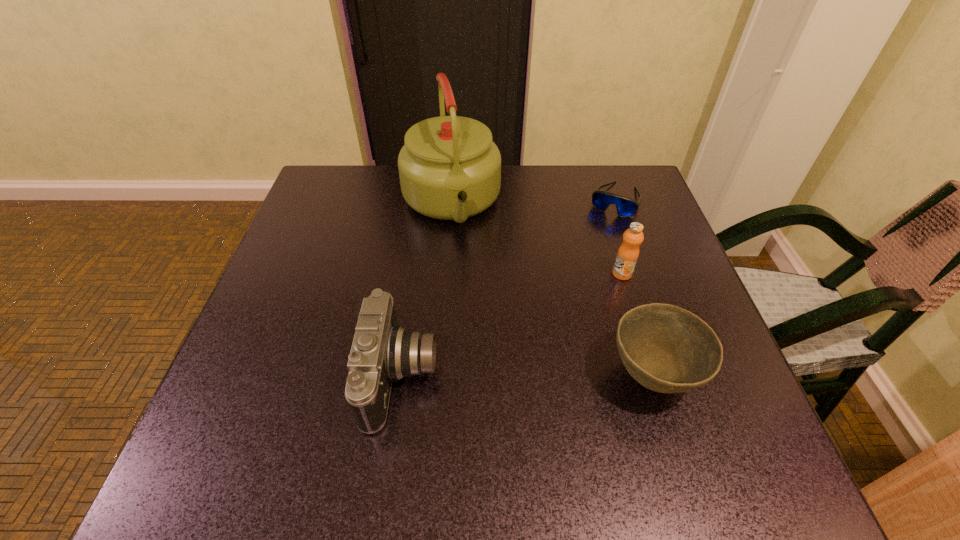
At what (x,y) coordinates should I click in order to perform the action: click on vacant space on the desktop that is between the camera and the bowl and is positioned on the front-facing side of the shortest object. Please return your answer as a coordinate pair (x, y). The height and width of the screenshot is (540, 960). Looking at the image, I should click on (529, 375).

Image resolution: width=960 pixels, height=540 pixels. What are the coordinates of `vacant space on the desktop that is between the camera and the second shortest object and is positioned on the front label of the third nearest object` in the screenshot? It's located at (519, 375).

Where is `free space on the desktop that is between the camera and the second shortest object and is positioned at the spout of the tallest object`? This screenshot has width=960, height=540. free space on the desktop that is between the camera and the second shortest object and is positioned at the spout of the tallest object is located at coordinates (494, 375).